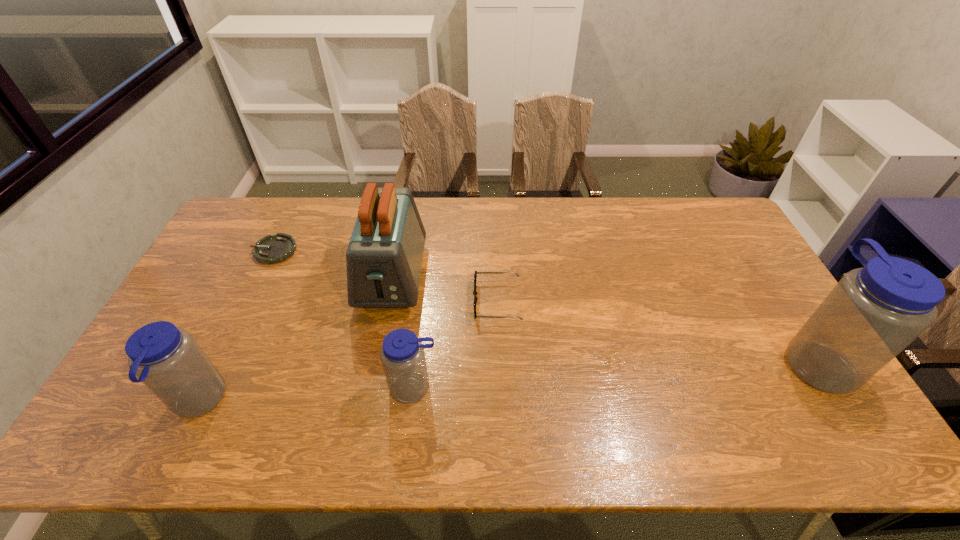
This screenshot has height=540, width=960. In order to click on vacant area that lies between the spectacles and the tallest water bottle in this screenshot , I will do `click(657, 331)`.

Where is `free space between the leftmost water bottle and the rightmost water bottle`? Image resolution: width=960 pixels, height=540 pixels. free space between the leftmost water bottle and the rightmost water bottle is located at coordinates (507, 381).

The image size is (960, 540). Identify the location of free space that is in between the tallest water bottle and the toaster. (604, 319).

At what (x,y) coordinates should I click in order to perform the action: click on free space that is in between the fourth shortest object and the rightmost object. Please return your answer as a coordinate pair (x, y). Looking at the image, I should click on (507, 381).

The width and height of the screenshot is (960, 540). Find the location of `blank region between the fourth tallest object and the leftmost water bottle`. blank region between the fourth tallest object and the leftmost water bottle is located at coordinates 306,395.

Identify the location of blank region between the shortest water bottle and the second object from right to left. The width and height of the screenshot is (960, 540). (456, 345).

The image size is (960, 540). Find the location of `free space between the shortest water bottle and the leftmost water bottle`. free space between the shortest water bottle and the leftmost water bottle is located at coordinates (306, 395).

Where is `vacant region between the toaster and the third tallest object`? vacant region between the toaster and the third tallest object is located at coordinates (296, 340).

Locate an element on the screen. This screenshot has width=960, height=540. free space between the toaster and the second tallest water bottle is located at coordinates (296, 340).

Locate which object is the second closest to the second shortest water bottle. Please provide its 2D coordinates. Your answer should be formatted as a tuple, i.e. [(x, y)], where the tuple contains the x and y coordinates of a point satisfying the conditions above.

[(402, 355)]